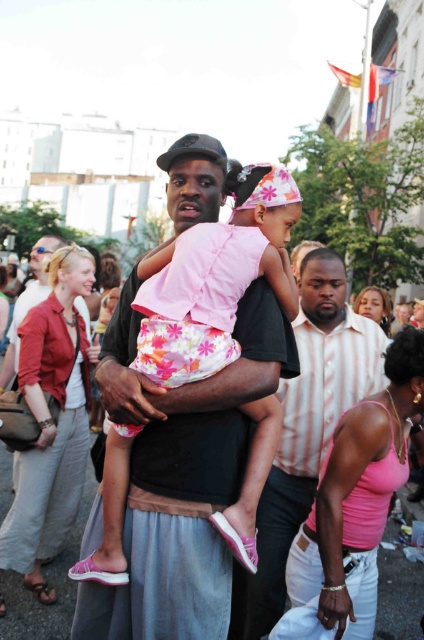
You are a photographer at the event and want to capture the man and girl in the scene. The matte red blouse at center and pink fabric dress at center are part of their outfits. Which of these two items is positioned lower on the person wearing them?

The matte red blouse at center is positioned lower on the person wearing it compared to the pink fabric dress at center because the description states that the matte red blouse at center is below the pink fabric dress at center.

You are standing at the point with coordinates point (72, 273) and want to walk towards the point with coordinates point (368, 291). According to the scene, will you be moving towards the crowd or away from it?

Point (72, 273) is in front of point (368, 291). Since you are moving from a point in front to a point behind it, you would be moving away from the crowd.